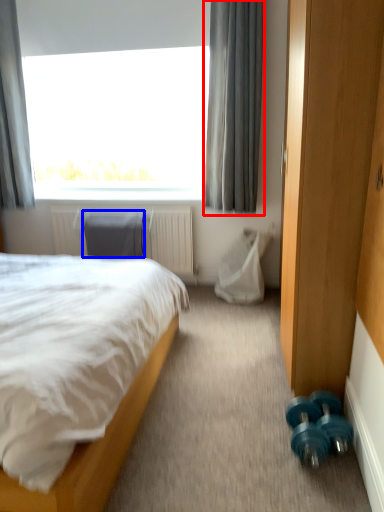
Question: Which object appears farthest to the camera in this image, curtain (highlighted by a red box) or swivel chair (highlighted by a blue box)?

Choices:
 (A) curtain
 (B) swivel chair

Answer: (B)